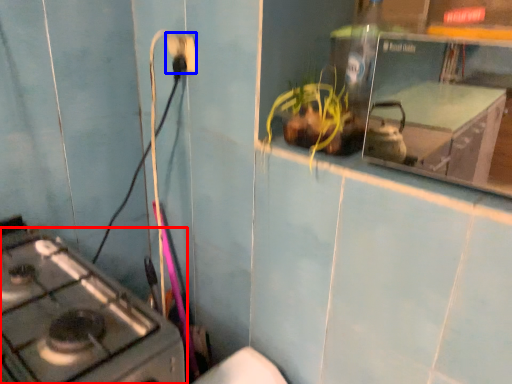
Question: Which of the following is the closest to the observer, gas stove (highlighted by a red box) or electric outlet (highlighted by a blue box)?

Choices:
 (A) gas stove
 (B) electric outlet

Answer: (A)